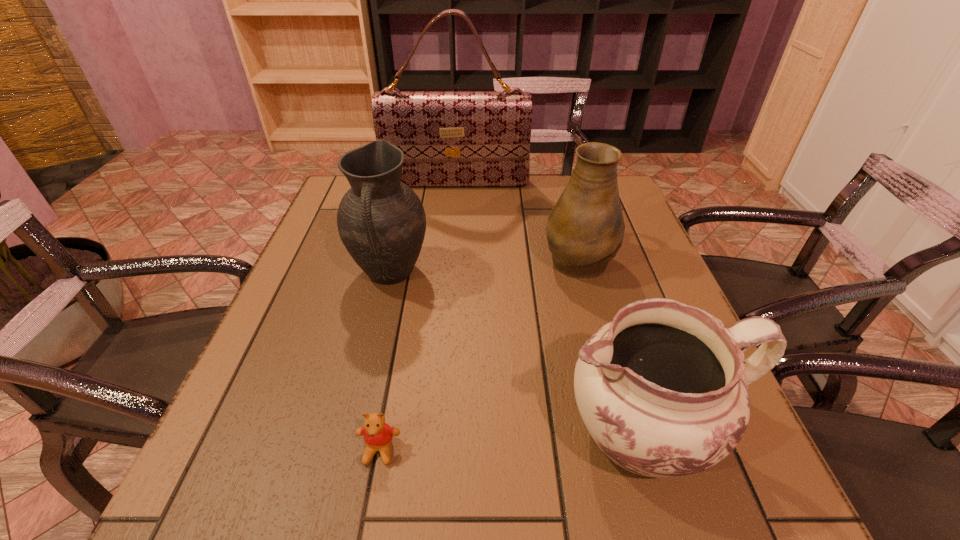
The width and height of the screenshot is (960, 540). In order to click on free region located 0.400m on the spout of the shortest pitcher in this screenshot , I will do `click(316, 431)`.

Find the location of `object that is at the far edge`. object that is at the far edge is located at coordinates (449, 138).

This screenshot has width=960, height=540. In order to click on pitcher present at the near edge in this screenshot , I will do `click(663, 390)`.

Where is `teddy bear that is at the near edge`? This screenshot has height=540, width=960. teddy bear that is at the near edge is located at coordinates (378, 435).

Find the location of `handbag that is at the left edge`. handbag that is at the left edge is located at coordinates (449, 138).

The height and width of the screenshot is (540, 960). Find the location of `pitcher located at the left edge`. pitcher located at the left edge is located at coordinates (381, 221).

Where is `object present at the far left corner`? object present at the far left corner is located at coordinates (449, 138).

Identify the location of object that is at the near right corner. The width and height of the screenshot is (960, 540). (663, 390).

Locate an element on the screen. The height and width of the screenshot is (540, 960). free space at the far edge of the desktop is located at coordinates (479, 195).

Find the location of `blank space at the near edge of the desktop`. blank space at the near edge of the desktop is located at coordinates (361, 488).